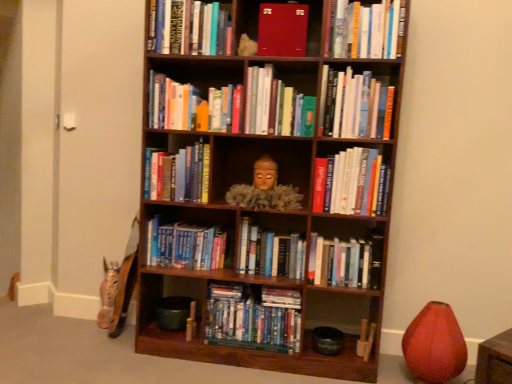
This screenshot has width=512, height=384. What do you see at coordinates (270, 252) in the screenshot? I see `hardcover books at center, the 3th book in the bottom-to-top sequence` at bounding box center [270, 252].

This screenshot has width=512, height=384. Find the location of `hardcover books at center, which ranks as the 10th book in top-to-bottom order`. hardcover books at center, which ranks as the 10th book in top-to-bottom order is located at coordinates (270, 252).

Image resolution: width=512 pixels, height=384 pixels. I want to click on hardcover books at center, which is the 7th book in top-to-bottom order, so click(x=178, y=174).

This screenshot has width=512, height=384. I want to click on hardcover books at upper center, the 10th book positioned from the bottom, so click(x=365, y=29).

What do you see at coordinates (265, 190) in the screenshot? This screenshot has height=384, width=512. I see `matte gold statue at center` at bounding box center [265, 190].

The width and height of the screenshot is (512, 384). What do you see at coordinates (185, 245) in the screenshot?
I see `blue hardcover books at center, the ninth book viewed from the top` at bounding box center [185, 245].

What do you see at coordinates (253, 318) in the screenshot? The image size is (512, 384). I see `blue hardcover books at center, positioned as the first book in bottom-to-top order` at bounding box center [253, 318].

Find the location of `hardcover books at center, which ranks as the 10th book in top-to-bottom order`. hardcover books at center, which ranks as the 10th book in top-to-bottom order is located at coordinates (270, 252).

From the image's perspective, does hardcover books at upper right, the seventh book ordered from the bottom, appear higher than matte gold statue at center?

Indeed, from the image's perspective, hardcover books at upper right, the seventh book ordered from the bottom, is shown above matte gold statue at center.

Would you say hardcover books at upper right, the 6th book when ordered from top to bottom, is outside matte gold statue at center?

hardcover books at upper right, the 6th book when ordered from top to bottom, is positioned outside matte gold statue at center.

Which is behind, point (348, 119) or point (274, 175)?

Point (274, 175)

Considering the sizes of objects hardcover books at upper right, the seventh book ordered from the bottom, and matte gold statue at center in the image provided, who is bigger, hardcover books at upper right, the seventh book ordered from the bottom, or matte gold statue at center?

With larger size is matte gold statue at center.

From a real-world perspective, relative to matte red book at upper center, which is the eleventh book in bottom-to-top order, is blue hardcover books at center, the second book positioned from the bottom, vertically above or below?

Clearly, from a real-world perspective, blue hardcover books at center, the second book positioned from the bottom, is below matte red book at upper center, which is the eleventh book in bottom-to-top order.

How many degrees apart are the facing directions of blue hardcover books at center, which is the eleventh book from top to bottom, and matte red book at upper center, the second book from the top?

The angle between the facing direction of blue hardcover books at center, which is the eleventh book from top to bottom, and the facing direction of matte red book at upper center, the second book from the top, is 2 degrees.

Can you confirm if blue hardcover books at center, which is the eleventh book from top to bottom, is positioned to the right of matte red book at upper center, which is the eleventh book in bottom-to-top order?

Indeed, blue hardcover books at center, which is the eleventh book from top to bottom, is positioned on the right side of matte red book at upper center, which is the eleventh book in bottom-to-top order.

In the scene shown: Does blue hardcover books at center, the second book positioned from the bottom, have a lesser height compared to matte red book at upper center, which is the eleventh book in bottom-to-top order?

Yes.

How different are the orientations of blue hardcover books at center, the 12th book viewed from the top, and hardcover books at center, the 3th book in the bottom-to-top sequence, in degrees?

They differ by 2.78 degrees in their facing directions.

Considering the points (285, 344) and (295, 249), which point is behind, point (285, 344) or point (295, 249)?

The point (295, 249) is farther from the camera.

From the image's perspective, is blue hardcover books at center, the 12th book viewed from the top, beneath hardcover books at center, which ranks as the 10th book in top-to-bottom order?

Yes, from the image's perspective, blue hardcover books at center, the 12th book viewed from the top, is below hardcover books at center, which ranks as the 10th book in top-to-bottom order.

From a real-world perspective, count 3rd books downward from the hardcover books at center, the 3th book in the bottom-to-top sequence, and point to it. Please provide its 2D coordinates.

[(253, 318)]

Is matte red book at upper center, which is the eleventh book in bottom-to-top order, not near matte gold statue at center?

Actually, matte red book at upper center, which is the eleventh book in bottom-to-top order, and matte gold statue at center are a little close together.

From the image's perspective, which object appears higher, matte red book at upper center, the second book from the top, or matte gold statue at center?

matte red book at upper center, the second book from the top, from the image's perspective.

From a real-world perspective, between matte red book at upper center, the second book from the top, and matte gold statue at center, who is vertically lower?

matte gold statue at center is physically lower.

Does matte red book at upper center, which is the eleventh book in bottom-to-top order, have a greater height compared to matte gold statue at center?

Indeed, matte red book at upper center, which is the eleventh book in bottom-to-top order, has a greater height compared to matte gold statue at center.

Do you think matte red vase at lower right is within hardcover books at center, which appears as the eighth book when ordered from the bottom, or outside of it?

The correct answer is: outside.

Which point is more forward, (437, 371) or (261, 89)?

The point (437, 371) is more forward.

From the image's perspective, which object appears higher, matte red vase at lower right or hardcover books at center, the 5th book positioned from the top?

From the image's view, hardcover books at center, the 5th book positioned from the top, is above.

Looking at this image, is matte red vase at lower right placed right next to hardcover books at center, which appears as the eighth book when ordered from the bottom?

No, matte red vase at lower right is not in contact with hardcover books at center, which appears as the eighth book when ordered from the bottom.

Can you confirm if blue hardcover books at center, positioned as the first book in bottom-to-top order, is smaller than blue hardcover books at center, the 4th book ordered from the bottom?

Actually, blue hardcover books at center, positioned as the first book in bottom-to-top order, might be larger than blue hardcover books at center, the 4th book ordered from the bottom.

Is blue hardcover books at center, positioned as the first book in bottom-to-top order, to the right of blue hardcover books at center, the ninth book viewed from the top, from the viewer's perspective?

Yes, blue hardcover books at center, positioned as the first book in bottom-to-top order, is to the right of blue hardcover books at center, the ninth book viewed from the top.

Considering the points (254, 294) and (166, 228), which point is behind, point (254, 294) or point (166, 228)?

The point (166, 228) is behind.

The width and height of the screenshot is (512, 384). Identify the location of book that is the 4th object directly below the hardcover books at center, placed as the 8th book when sorted from top to bottom (from a real-world perspective). (253, 318).

In the image, is hardcover books at center, the 5th book ordered from the bottom, on the left side or the right side of blue hardcover books at center, the 12th book viewed from the top?

hardcover books at center, the 5th book ordered from the bottom, is positioned on blue hardcover books at center, the 12th book viewed from the top,'s right side.

What's the angular difference between hardcover books at center, placed as the 8th book when sorted from top to bottom, and blue hardcover books at center, positioned as the first book in bottom-to-top order,'s facing directions?

0.0211 degrees.

Considering the positions of objects hardcover books at center, the 5th book ordered from the bottom, and blue hardcover books at center, positioned as the first book in bottom-to-top order, in the image provided, who is behind, hardcover books at center, the 5th book ordered from the bottom, or blue hardcover books at center, positioned as the first book in bottom-to-top order,?

blue hardcover books at center, positioned as the first book in bottom-to-top order, is behind.

At what (x,y) coordinates should I click in order to perform the action: click on person below the hardcover books at upper right, the 6th book when ordered from top to bottom (from the image's perspective). Please return your answer as a coordinate pair (x, y). Image resolution: width=512 pixels, height=384 pixels. Looking at the image, I should click on (265, 190).

Identify the location of book that is the 9th one when counting upward from the blue hardcover books at center, which is the eleventh book from top to bottom (from the image's perspective). (282, 30).

Looking at the image, which one is located closer to hardcover books at upper center, the 10th book positioned from the bottom, hardcover books at upper center, the first book positioned from the top, or hardcover book at upper center, the 9th book in the bottom-to-top sequence?

Among the two, hardcover book at upper center, the 9th book in the bottom-to-top sequence, is located nearer to hardcover books at upper center, the 10th book positioned from the bottom.

Which object lies further to the anchor point matte gold statue at center, blue hardcover books at center, the 12th book viewed from the top, or matte red book at upper center, the second book from the top?

The object further to matte gold statue at center is matte red book at upper center, the second book from the top.

From the image, which object appears to be farther from blue hardcover books at center, positioned as the first book in bottom-to-top order, matte gold statue at center or mahogany wood bookcase at center?

The object further to blue hardcover books at center, positioned as the first book in bottom-to-top order, is matte gold statue at center.

Considering their positions, is hardcover books at center, the 5th book positioned from the top, positioned further to blue hardcover books at center, the ninth book viewed from the top, than blue hardcover books at center, the second book positioned from the bottom?

hardcover books at center, the 5th book positioned from the top, is positioned further to the anchor blue hardcover books at center, the ninth book viewed from the top.

Looking at the image, which one is located further to hardcover books at upper center, the 10th book positioned from the bottom, hardcover books at center, the 6th book positioned from the bottom, or matte red vase at lower right?

matte red vase at lower right lies further to hardcover books at upper center, the 10th book positioned from the bottom, than the other object.

From the image, which object appears to be nearer to blue hardcover books at center, positioned as the first book in bottom-to-top order, matte red book at upper center, the second book from the top, or blue hardcover books at center, the 4th book ordered from the bottom?

Based on the image, blue hardcover books at center, the 4th book ordered from the bottom, appears to be nearer to blue hardcover books at center, positioned as the first book in bottom-to-top order.

From the image, which object appears to be nearer to matte red vase at lower right, blue hardcover books at center, positioned as the first book in bottom-to-top order, or matte red book at upper center, which is the eleventh book in bottom-to-top order?

blue hardcover books at center, positioned as the first book in bottom-to-top order, lies closer to matte red vase at lower right than the other object.

From the picture: Which object lies further to the anchor point blue hardcover books at center, positioned as the first book in bottom-to-top order, hardcover books at center, the 3th book in the bottom-to-top sequence, or hardcover books at upper center, the third book when ordered from top to bottom?

The object further to blue hardcover books at center, positioned as the first book in bottom-to-top order, is hardcover books at upper center, the third book when ordered from top to bottom.

What are the coordinates of `bookcase between matte gold statue at center and hardcover books at upper right, the 6th book when ordered from top to bottom` in the screenshot? It's located at (276, 233).

The image size is (512, 384). What are the coordinates of `person located between hardcover book at upper center, positioned as the fourth book in top-to-bottom order, and hardcover books at upper right, the seventh book ordered from the bottom, in the left-right direction` in the screenshot? It's located at (265, 190).

Where is `bookcase situated between hardcover books at center, which is the 7th book in top-to-bottom order, and blue hardcover books at center, the second book positioned from the bottom, from left to right`? This screenshot has height=384, width=512. bookcase situated between hardcover books at center, which is the 7th book in top-to-bottom order, and blue hardcover books at center, the second book positioned from the bottom, from left to right is located at coordinates (276, 233).

At what (x,y) coordinates should I click in order to perform the action: click on person located between hardcover books at upper center, the first book positioned from the top, and hardcover books at upper right, the 6th book when ordered from top to bottom, in the left-right direction. Please return your answer as a coordinate pair (x, y). This screenshot has width=512, height=384. Looking at the image, I should click on 265,190.